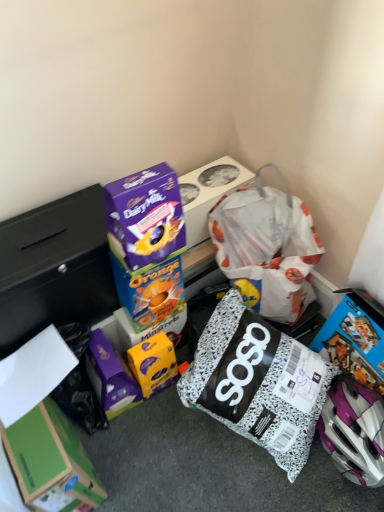
Question: Which direction should I rotate to look at yellow matte chocolate bar at center, which is the fourth box from top to bottom?

Choices:
 (A) right
 (B) left

Answer: (B)

Question: From a real-world perspective, is purple glossy chocolate bar at upper center, positioned as the fourth box in bottom-to-top order, under purple cardboard dairy milk chocolate bar at upper center, arranged as the 1th box when viewed from the top?

Choices:
 (A) no
 (B) yes

Answer: (A)

Question: Is purple glossy chocolate bar at upper center, which is counted as the 2th box, starting from the top, to the left of purple cardboard dairy milk chocolate bar at upper center, arranged as the 1th box when viewed from the top, from the viewer's perspective?

Choices:
 (A) no
 (B) yes

Answer: (B)

Question: Does purple glossy chocolate bar at upper center, positioned as the fourth box in bottom-to-top order, come in front of purple cardboard dairy milk chocolate bar at upper center, the fifth box in the bottom-to-top sequence?

Choices:
 (A) no
 (B) yes

Answer: (B)

Question: Would you consider purple glossy chocolate bar at upper center, which is counted as the 2th box, starting from the top, to be distant from purple cardboard dairy milk chocolate bar at upper center, arranged as the 1th box when viewed from the top?

Choices:
 (A) no
 (B) yes

Answer: (A)

Question: From the image's perspective, does purple glossy chocolate bar at upper center, which is counted as the 2th box, starting from the top, appear lower than purple cardboard dairy milk chocolate bar at upper center, the fifth box in the bottom-to-top sequence?

Choices:
 (A) no
 (B) yes

Answer: (B)

Question: Is purple glossy chocolate bar at upper center, positioned as the fourth box in bottom-to-top order, completely or partially outside of purple cardboard dairy milk chocolate bar at upper center, arranged as the 1th box when viewed from the top?

Choices:
 (A) no
 (B) yes

Answer: (B)

Question: From a real-world perspective, is purple cardboard dairy milk chocolate bar at upper center, the fifth box in the bottom-to-top sequence, on blue cardboard box at center, which appears as the third box when viewed from the top?

Choices:
 (A) no
 (B) yes

Answer: (A)

Question: Considering the relative positions of purple cardboard dairy milk chocolate bar at upper center, the fifth box in the bottom-to-top sequence, and blue cardboard box at center, which appears as the third box when viewed from the top, in the image provided, is purple cardboard dairy milk chocolate bar at upper center, the fifth box in the bottom-to-top sequence, in front of blue cardboard box at center, which appears as the third box when viewed from the top,?

Choices:
 (A) yes
 (B) no

Answer: (B)

Question: Considering the relative sizes of purple cardboard dairy milk chocolate bar at upper center, the fifth box in the bottom-to-top sequence, and blue cardboard box at center, the 3th box ordered from the bottom, in the image provided, is purple cardboard dairy milk chocolate bar at upper center, the fifth box in the bottom-to-top sequence, thinner than blue cardboard box at center, the 3th box ordered from the bottom,?

Choices:
 (A) no
 (B) yes

Answer: (A)

Question: Is purple cardboard dairy milk chocolate bar at upper center, the fifth box in the bottom-to-top sequence, not within blue cardboard box at center, which appears as the third box when viewed from the top?

Choices:
 (A) no
 (B) yes

Answer: (B)

Question: From a real-world perspective, is purple cardboard dairy milk chocolate bar at upper center, the fifth box in the bottom-to-top sequence, located beneath blue cardboard box at center, the 3th box ordered from the bottom?

Choices:
 (A) no
 (B) yes

Answer: (B)

Question: From the image's perspective, does purple cardboard dairy milk chocolate bar at upper center, the fifth box in the bottom-to-top sequence, appear higher than blue cardboard box at center, which appears as the third box when viewed from the top?

Choices:
 (A) no
 (B) yes

Answer: (B)

Question: Could you tell me if yellow matte chocolate bar at center, which is the fourth box from top to bottom, is facing white matte paper at lower left?

Choices:
 (A) no
 (B) yes

Answer: (A)